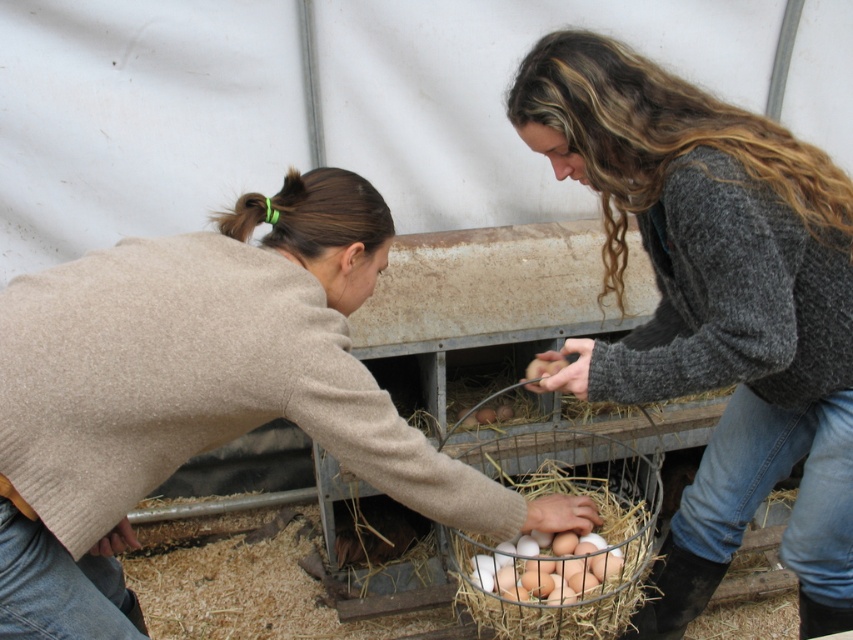
Question: Which point is farther to the camera?

Choices:
 (A) (97, 484)
 (B) (488, 556)
 (C) (650, 212)

Answer: (B)

Question: Which of the following is the farthest from the observer?

Choices:
 (A) white matte eggs at center
 (B) gray sweater at upper right
 (C) white straw nest at center
 (D) beige wool sweater at lower left

Answer: (A)

Question: Which of these objects is positioned closest to the gray sweater at upper right?

Choices:
 (A) beige wool sweater at lower left
 (B) white matte eggs at center

Answer: (B)

Question: Can you confirm if gray sweater at upper right is positioned to the right of white matte eggs at center?

Choices:
 (A) no
 (B) yes

Answer: (B)

Question: Is beige wool sweater at lower left bigger than white straw nest at center?

Choices:
 (A) no
 (B) yes

Answer: (B)

Question: Observing the image, what is the correct spatial positioning of white straw nest at center in reference to white matte eggs at center?

Choices:
 (A) left
 (B) right

Answer: (B)